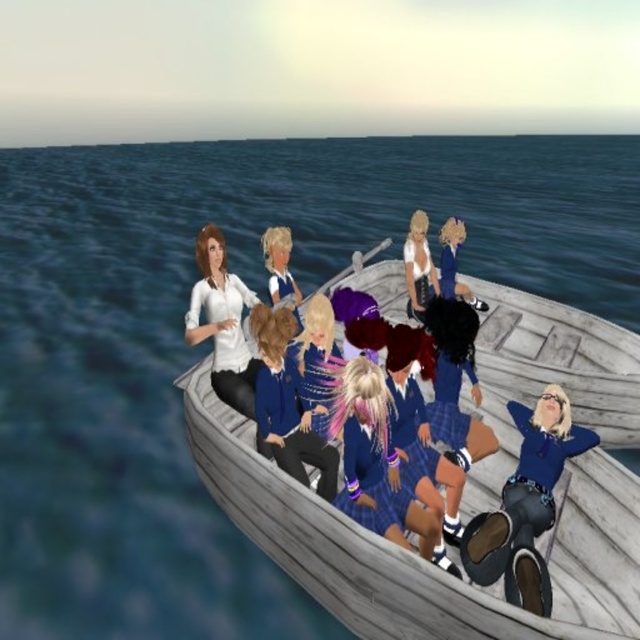
Question: Which point appears closest to the camera in this image?

Choices:
 (A) (452, 396)
 (B) (627, 593)

Answer: (B)

Question: Which of the following is the closest to the observer?

Choices:
 (A) shiny purple hair at center
 (B) blue denim jeans at lower right

Answer: (B)

Question: Is plaid fabric skirt at center below matte blue jacket at center?

Choices:
 (A) yes
 (B) no

Answer: (A)

Question: Does white glossy tank top at center lie in front of matte blue jacket at center?

Choices:
 (A) yes
 (B) no

Answer: (B)

Question: Does wooden boat at center have a lesser width compared to shiny purple hair at center?

Choices:
 (A) yes
 (B) no

Answer: (A)

Question: Which object is closer to the camera taking this photo?

Choices:
 (A) blue denim jeans at lower right
 (B) shiny blue dress at center
 (C) plaid fabric skirt at center
 (D) wooden boat at center

Answer: (A)